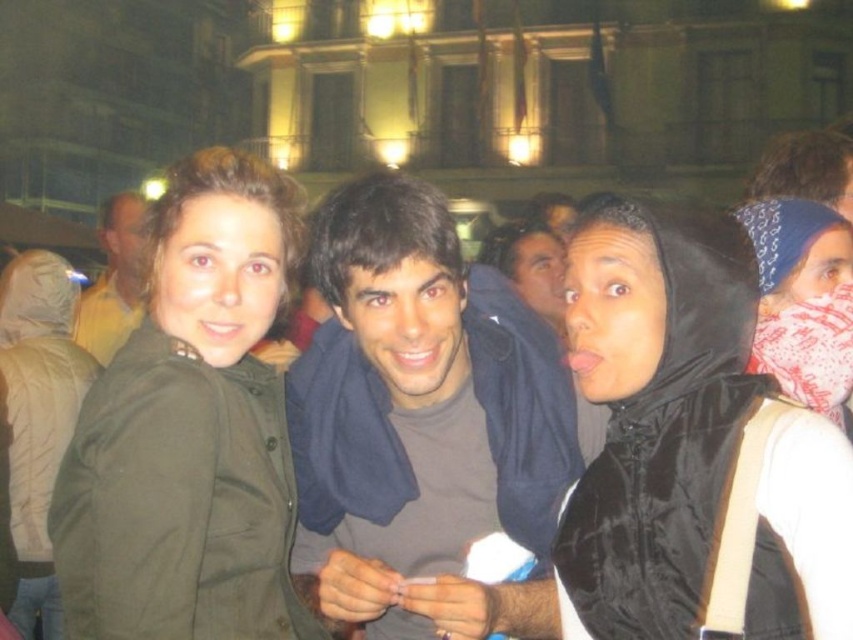
Which is behind, point (679, 384) or point (566, 273)?

The point (566, 273) is behind.

Is black matte jacket at center shorter than smooth black hoodie at center?

No, black matte jacket at center is not shorter than smooth black hoodie at center.

At what (x,y) coordinates should I click in order to perform the action: click on black matte jacket at center. Please return your answer as a coordinate pair (x, y). Looking at the image, I should click on (653, 412).

Measure the distance between matte green jacket at center and camera.

They are 51.79 meters apart.

Identify the location of matte green jacket at center. This screenshot has height=640, width=853. (218, 275).

This screenshot has height=640, width=853. What are the coordinates of `matte green jacket at center` in the screenshot? It's located at (218, 275).

Is green matte jacket at center to the left of smooth brown shirt at center from the viewer's perspective?

Indeed, green matte jacket at center is positioned on the left side of smooth brown shirt at center.

Locate an element on the screen. Image resolution: width=853 pixels, height=640 pixels. green matte jacket at center is located at coordinates (190, 429).